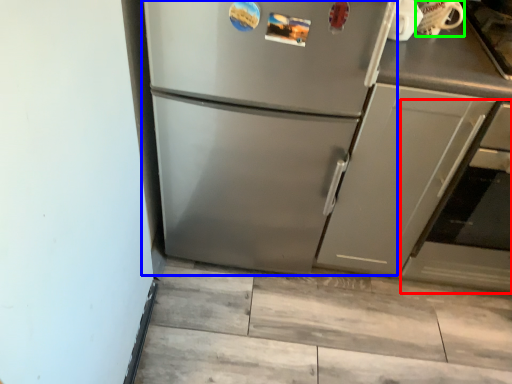
Question: Considering the real-world distances, which object is closest to oven (highlighted by a red box)? refrigerator (highlighted by a blue box) or appliance (highlighted by a green box).

Choices:
 (A) refrigerator
 (B) appliance

Answer: (B)